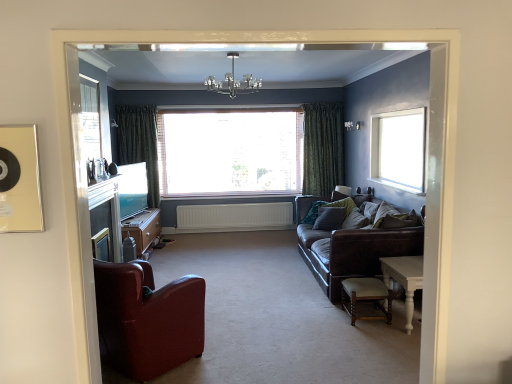
This screenshot has height=384, width=512. I want to click on free space that is in between light beige leather stool at lower right and white wood table at lower right, so click(382, 333).